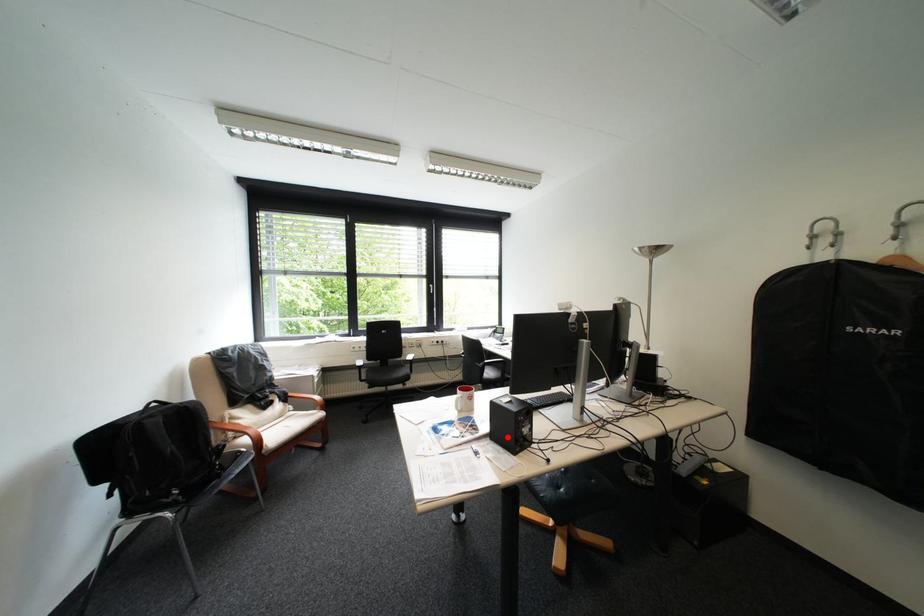
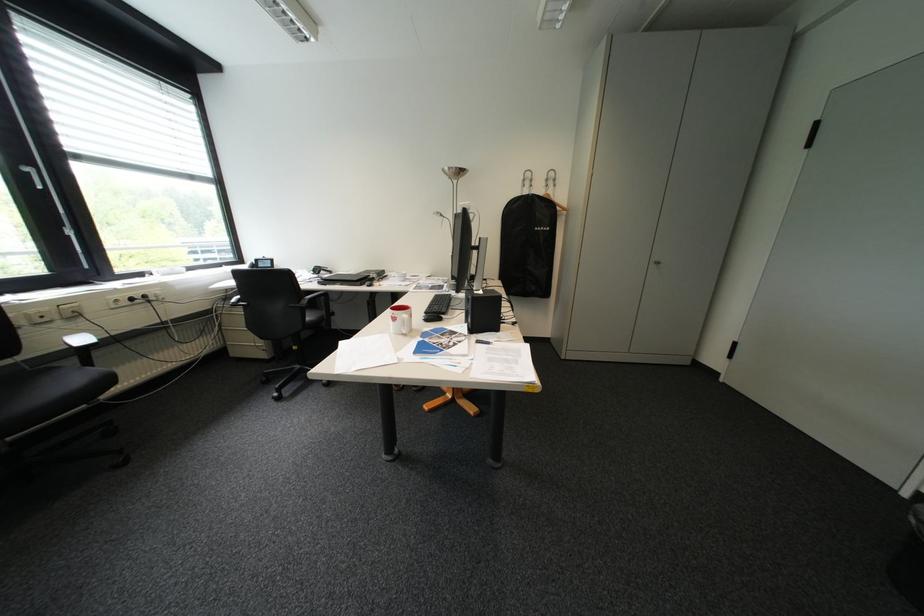
Question: I am providing you with two images of the same scene from different viewpoints. Image1 has a red point marked. In image2, the corresponding 3D location appears at what relative position? Reply with the corresponding letter.

Choices:
 (A) Closer
 (B) Farther

Answer: (A)